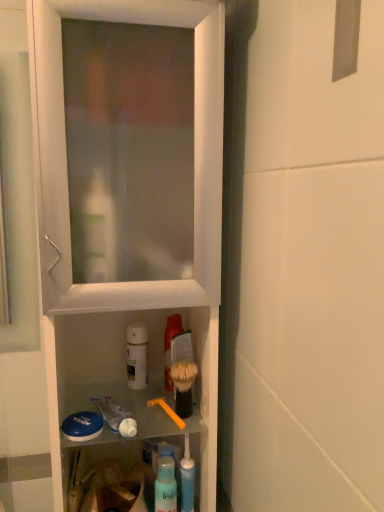
Question: Is blue translucent toothpaste tube at lower center inside translucent plastic mouthwash at center, placed as the first mouthwash when sorted from right to left?

Choices:
 (A) no
 (B) yes

Answer: (A)

Question: Is the depth of translucent plastic mouthwash at center, which is counted as the 2th mouthwash, starting from the left, greater than that of blue translucent toothpaste tube at lower center?

Choices:
 (A) yes
 (B) no

Answer: (A)

Question: Is translucent plastic mouthwash at center, placed as the first mouthwash when sorted from right to left, taller than blue translucent toothpaste tube at lower center?

Choices:
 (A) yes
 (B) no

Answer: (B)

Question: Is the depth of translucent plastic mouthwash at center, placed as the first mouthwash when sorted from right to left, less than that of blue translucent toothpaste tube at lower center?

Choices:
 (A) yes
 (B) no

Answer: (B)

Question: From the image's perspective, is translucent plastic mouthwash at center, placed as the first mouthwash when sorted from right to left, located beneath blue translucent toothpaste tube at lower center?

Choices:
 (A) no
 (B) yes

Answer: (A)

Question: From their relative heights in the image, would you say translucent plastic spray bottle at lower center is taller or shorter than white glossy toothpaste at lower center?

Choices:
 (A) tall
 (B) short

Answer: (A)

Question: Looking at their shapes, would you say translucent plastic spray bottle at lower center is wider or thinner than white glossy toothpaste at lower center?

Choices:
 (A) thin
 (B) wide

Answer: (A)

Question: Is point (165, 503) positioned closer to the camera than point (134, 420)?

Choices:
 (A) farther
 (B) closer

Answer: (B)

Question: From a real-world perspective, is translucent plastic spray bottle at lower center physically located above or below white glossy toothpaste at lower center?

Choices:
 (A) above
 (B) below

Answer: (B)

Question: From the image's perspective, is translucent plastic spray bottle at lower center positioned above or below translucent plastic mouthwash at center, placed as the first mouthwash when sorted from right to left?

Choices:
 (A) above
 (B) below

Answer: (B)

Question: Considering the positions of translucent plastic spray bottle at lower center and translucent plastic mouthwash at center, placed as the first mouthwash when sorted from right to left, in the image, is translucent plastic spray bottle at lower center bigger or smaller than translucent plastic mouthwash at center, placed as the first mouthwash when sorted from right to left,?

Choices:
 (A) small
 (B) big

Answer: (A)

Question: In terms of height, does translucent plastic spray bottle at lower center look taller or shorter compared to translucent plastic mouthwash at center, which is counted as the 2th mouthwash, starting from the left?

Choices:
 (A) short
 (B) tall

Answer: (A)

Question: Is translucent plastic spray bottle at lower center wider or thinner than translucent plastic mouthwash at center, which is counted as the 2th mouthwash, starting from the left?

Choices:
 (A) thin
 (B) wide

Answer: (A)

Question: From a real-world perspective, is white matte bottle at center, positioned as the first mouthwash in left-to-right order, positioned above or below translucent plastic mouthwash at center, which is counted as the 2th mouthwash, starting from the left?

Choices:
 (A) above
 (B) below

Answer: (B)

Question: Considering their positions, is white matte bottle at center, which ranks as the second mouthwash in right-to-left order, located in front of or behind translucent plastic mouthwash at center, which is counted as the 2th mouthwash, starting from the left?

Choices:
 (A) front
 (B) behind

Answer: (B)